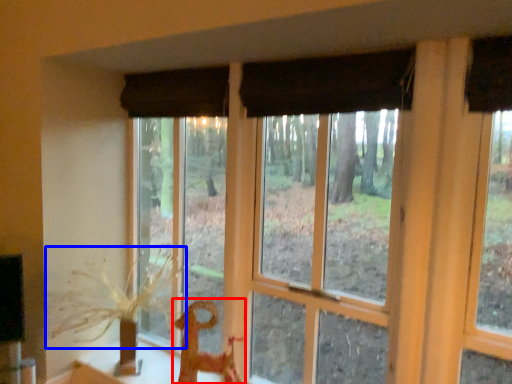
Question: Which object appears closest to the camera in this image, animal (highlighted by a red box) or plant (highlighted by a blue box)?

Choices:
 (A) animal
 (B) plant

Answer: (B)